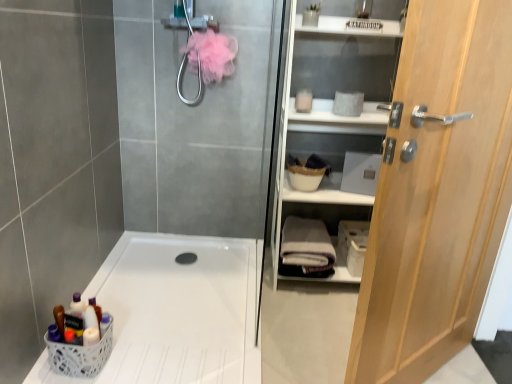
Question: Is white matte shelf at right closer to the viewer compared to white plastic bath at lower left?

Choices:
 (A) no
 (B) yes

Answer: (A)

Question: Can we say white matte shelf at right lies outside white plastic bath at lower left?

Choices:
 (A) yes
 (B) no

Answer: (A)

Question: Is white matte shelf at right facing towards white plastic bath at lower left?

Choices:
 (A) yes
 (B) no

Answer: (B)

Question: From a real-world perspective, is white matte shelf at right physically below white plastic bath at lower left?

Choices:
 (A) no
 (B) yes

Answer: (A)

Question: Considering the relative sizes of white matte shelf at right and white plastic bath at lower left in the image provided, is white matte shelf at right thinner than white plastic bath at lower left?

Choices:
 (A) yes
 (B) no

Answer: (A)

Question: From a real-world perspective, relative to light wood door at right, is white plastic basket at lower left vertically above or below?

Choices:
 (A) below
 (B) above

Answer: (A)

Question: From their relative heights in the image, would you say white plastic basket at lower left is taller or shorter than light wood door at right?

Choices:
 (A) short
 (B) tall

Answer: (A)

Question: Is white plastic basket at lower left in front of or behind light wood door at right in the image?

Choices:
 (A) front
 (B) behind

Answer: (B)

Question: Is white plastic basket at lower left to the left or to the right of light wood door at right in the image?

Choices:
 (A) left
 (B) right

Answer: (A)

Question: In terms of height, does white plastic bath at lower left look taller or shorter compared to white cotton bath towel at center?

Choices:
 (A) tall
 (B) short

Answer: (B)

Question: Visually, is white plastic bath at lower left positioned to the left or to the right of white cotton bath towel at center?

Choices:
 (A) left
 (B) right

Answer: (A)

Question: Do you think white plastic bath at lower left is within white cotton bath towel at center, or outside of it?

Choices:
 (A) outside
 (B) inside

Answer: (A)

Question: From the image's perspective, is white plastic bath at lower left positioned above or below white cotton bath towel at center?

Choices:
 (A) below
 (B) above

Answer: (A)

Question: Is white plastic bath at lower left taller or shorter than white plastic basket at lower left?

Choices:
 (A) tall
 (B) short

Answer: (B)

Question: From the image's perspective, is white plastic bath at lower left located above or below white plastic basket at lower left?

Choices:
 (A) above
 (B) below

Answer: (A)